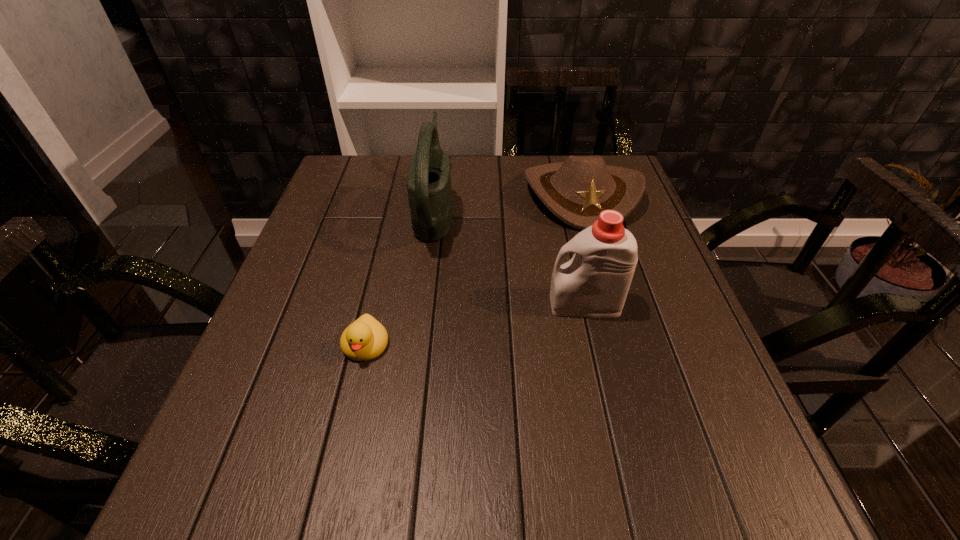
The image size is (960, 540). Identify the location of vacant space at the far left corner of the desktop. (375, 201).

Where is `unoccupied position between the third farthest object and the leftmost object`? unoccupied position between the third farthest object and the leftmost object is located at coordinates (475, 325).

Where is `free point between the third object from right to left and the cowboy hat`? The height and width of the screenshot is (540, 960). free point between the third object from right to left and the cowboy hat is located at coordinates (508, 201).

Locate an element on the screen. Image resolution: width=960 pixels, height=540 pixels. blank region between the nearest object and the second object from left to right is located at coordinates (400, 277).

Image resolution: width=960 pixels, height=540 pixels. In order to click on free space between the third farthest object and the leftmost object in this screenshot , I will do `click(475, 325)`.

The image size is (960, 540). Identify the location of free area in between the second object from left to right and the detergent. (510, 257).

This screenshot has width=960, height=540. In order to click on free space that is in between the cowboy hat and the watering can in this screenshot , I will do coord(508,201).

At what (x,y) coordinates should I click in order to perform the action: click on free space between the watering can and the leftmost object. Please return your answer as a coordinate pair (x, y). The height and width of the screenshot is (540, 960). Looking at the image, I should click on (400, 277).

Identify the location of free spot between the shortest object and the second object from left to right. The height and width of the screenshot is (540, 960). (400, 277).

Locate an element on the screen. vacant space in between the second shortest object and the nearest object is located at coordinates (473, 269).